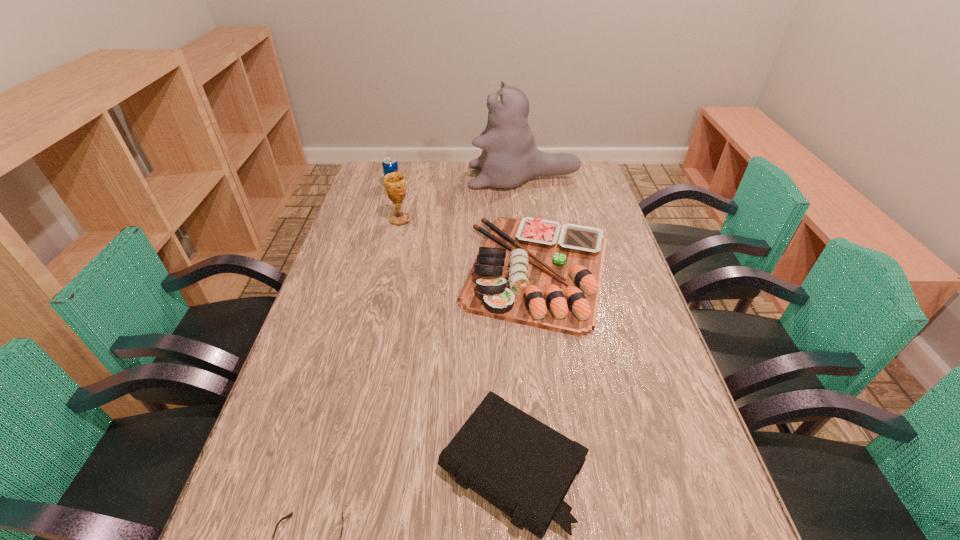
At what (x,y) coordinates should I click in order to perform the action: click on blank space at the right edge of the desktop. Please return your answer as a coordinate pair (x, y). This screenshot has height=540, width=960. Looking at the image, I should click on click(618, 363).

Identify the location of blank region between the platter and the pop soda. (466, 228).

You are a GUI agent. You are given a task and a screenshot of the screen. Output one action in this format:
    pyautogui.click(x=<x>, y=<y>)
    Task: Click on the unoccupied position between the fourth shortest object and the platter
    The height and width of the screenshot is (540, 960).
    Given the screenshot: What is the action you would take?
    pyautogui.click(x=466, y=228)

Locate an element on the screen. This screenshot has height=540, width=960. object that is the fourth closest one to the tallest object is located at coordinates (523, 467).

Point out which object is positioned as the fifth nearest to the third tallest object. Please provide its 2D coordinates. Your answer should be formatted as a tuple, i.e. [(x, y)], where the tuple contains the x and y coordinates of a point satisfying the conditions above.

[(291, 514)]

You are a GUI agent. You are given a task and a screenshot of the screen. Output one action in this format:
    pyautogui.click(x=<x>, y=<y>)
    Task: Click on the vacant region that satisfies the following two spatial constraints: 1. on the front side of the third shortest object; 2. on the left side of the pop soda
    
    Given the screenshot: What is the action you would take?
    pyautogui.click(x=370, y=270)